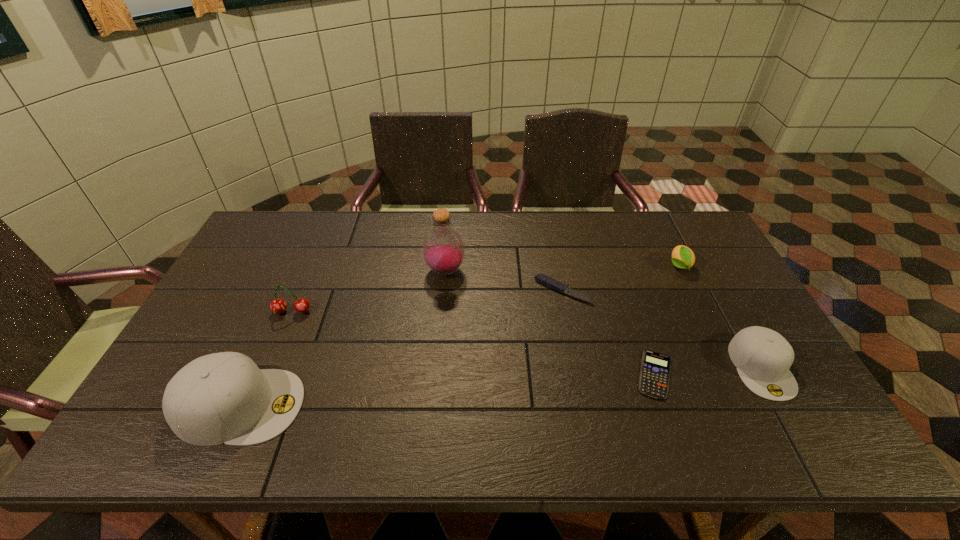
Where is `the third object from right to left`? the third object from right to left is located at coordinates (654, 377).

The width and height of the screenshot is (960, 540). Identify the location of free region located 0.080m on the front-facing side of the taller cap. pyautogui.click(x=335, y=406).

Image resolution: width=960 pixels, height=540 pixels. In order to click on blank space located with stems pointing upwards on the cherry in this screenshot , I will do `click(268, 370)`.

This screenshot has width=960, height=540. I want to click on vacant space located 0.100m with leaves positioned above the fifth tallest object, so click(696, 301).

Find the location of `free space located 0.320m on the front of the sixth tallest object`. free space located 0.320m on the front of the sixth tallest object is located at coordinates (585, 403).

Locate an element on the screen. vacant space located 0.370m on the front of the fifth object from right to left is located at coordinates 435,389.

Locate an element on the screen. This screenshot has height=540, width=960. vacant space located 0.380m on the left of the shortest object is located at coordinates (484, 374).

Where is `calculator that is at the near edge`? calculator that is at the near edge is located at coordinates (654, 377).

Where is `object located in the left edge section of the desktop`? The image size is (960, 540). object located in the left edge section of the desktop is located at coordinates (224, 397).

At what (x,y) coordinates should I click in order to perform the action: click on cap that is positioned at the right edge. Please return your answer as a coordinate pair (x, y). The height and width of the screenshot is (540, 960). Looking at the image, I should click on (763, 357).